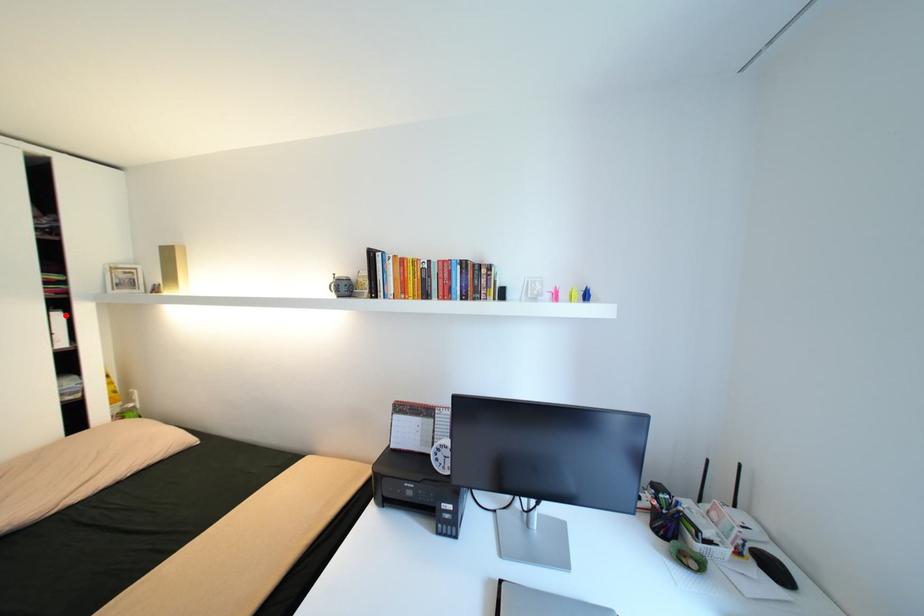
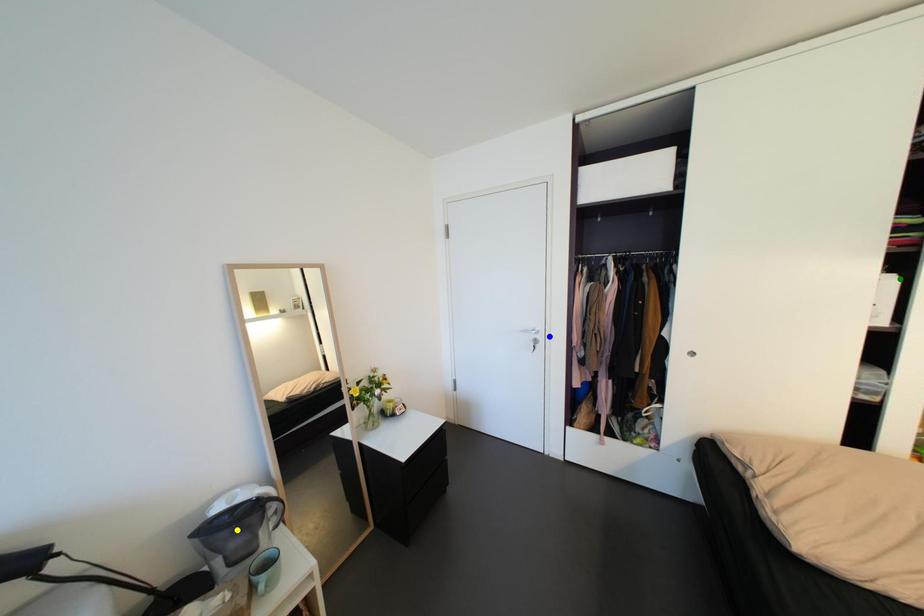
Question: I am providing you with two images of the same scene from different viewpoints. A red point is marked on the first image. You are given multiple points on the second image. Which point in image 2 represents the same 3d spot as the red point in image 1?

Choices:
 (A) blue point
 (B) green point
 (C) yellow point

Answer: (B)